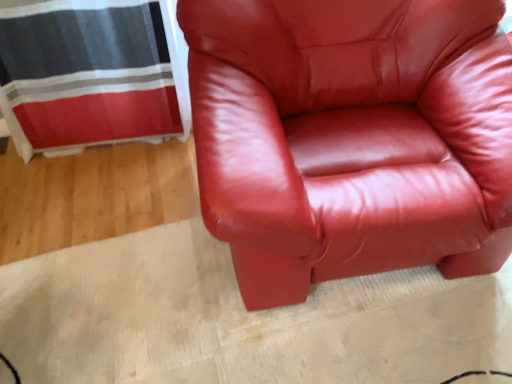
In order to click on glossy leather chair at center in this screenshot , I will do `click(351, 138)`.

Describe the element at coordinates (351, 138) in the screenshot. I see `glossy leather chair at center` at that location.

The width and height of the screenshot is (512, 384). Identify the location of glossy leather chair at center. (351, 138).